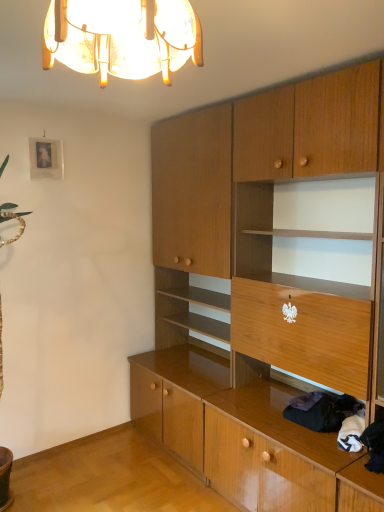
What do you see at coordinates (321, 410) in the screenshot?
I see `dark woolen sweater at lower right` at bounding box center [321, 410].

What do you see at coordinates (46, 158) in the screenshot? I see `matte silver picture frame at upper left` at bounding box center [46, 158].

Locate an element on the screen. Image resolution: width=384 pixels, height=512 pixels. dark woolen sweater at lower right is located at coordinates (321, 410).

Between translucent glass chandelier at upper center and wooden cabinet at center, which one has larger width?

Wider between the two is wooden cabinet at center.

Considering the sizes of translucent glass chandelier at upper center and wooden cabinet at center in the image, is translucent glass chandelier at upper center taller or shorter than wooden cabinet at center?

Clearly, translucent glass chandelier at upper center is shorter compared to wooden cabinet at center.

Can we say translucent glass chandelier at upper center lies outside wooden cabinet at center?

translucent glass chandelier at upper center lies outside wooden cabinet at center's area.

Considering the sizes of matte silver picture frame at upper left and wooden cabinet at center in the image, is matte silver picture frame at upper left bigger or smaller than wooden cabinet at center?

matte silver picture frame at upper left is smaller than wooden cabinet at center.

Is matte silver picture frame at upper left oriented towards wooden cabinet at center?

No.

Which is in front, point (41, 150) or point (330, 298)?

The point (330, 298) is in front.

In terms of width, does matte silver picture frame at upper left look wider or thinner when compared to wooden cabinet at center?

Considering their sizes, matte silver picture frame at upper left looks slimmer than wooden cabinet at center.

Is matte silver picture frame at upper left bigger than translucent glass chandelier at upper center?

No, matte silver picture frame at upper left is not bigger than translucent glass chandelier at upper center.

Can you confirm if matte silver picture frame at upper left is taller than translucent glass chandelier at upper center?

Correct, matte silver picture frame at upper left is much taller as translucent glass chandelier at upper center.

Does matte silver picture frame at upper left lie behind translucent glass chandelier at upper center?

Yes, it is behind translucent glass chandelier at upper center.

Looking at this image, from a real-world perspective, which is physically above, matte silver picture frame at upper left or translucent glass chandelier at upper center?

translucent glass chandelier at upper center is physically above.

Can you confirm if translucent glass chandelier at upper center is shorter than dark woolen sweater at lower right?

Incorrect, the height of translucent glass chandelier at upper center does not fall short of that of dark woolen sweater at lower right.

Is translucent glass chandelier at upper center completely or partially outside of dark woolen sweater at lower right?

Absolutely, translucent glass chandelier at upper center is external to dark woolen sweater at lower right.

In the scene shown: Is translucent glass chandelier at upper center oriented away from dark woolen sweater at lower right?

translucent glass chandelier at upper center does not have its back to dark woolen sweater at lower right.

From the image's perspective, is translucent glass chandelier at upper center above or below dark woolen sweater at lower right?

Based on their image positions, translucent glass chandelier at upper center is located above dark woolen sweater at lower right.

Would you consider wooden cabinet at center to be distant from dark woolen sweater at lower right?

No, wooden cabinet at center is in close proximity to dark woolen sweater at lower right.

From the image's perspective, is wooden cabinet at center above dark woolen sweater at lower right?

Yes, from the image's perspective, wooden cabinet at center is above dark woolen sweater at lower right.

In the scene shown: What's the angular difference between wooden cabinet at center and dark woolen sweater at lower right's facing directions?

They differ by 0.000452 degrees in their facing directions.

From a real-world perspective, is wooden cabinet at center positioned over matte silver picture frame at upper left based on gravity?

No, from a real-world perspective, wooden cabinet at center is not over matte silver picture frame at upper left

Which is more to the right, wooden cabinet at center or matte silver picture frame at upper left?

Positioned to the right is wooden cabinet at center.

Is point (366, 493) closer or farther from the camera than point (56, 148)?

Point (366, 493) appears to be closer to the viewer than point (56, 148).

Between wooden cabinet at center and matte silver picture frame at upper left, which one is positioned behind?

matte silver picture frame at upper left is more distant.

From the image's perspective, which object appears higher, matte silver picture frame at upper left or dark woolen sweater at lower right?

matte silver picture frame at upper left.

Between matte silver picture frame at upper left and dark woolen sweater at lower right, which one is positioned behind?

Positioned behind is matte silver picture frame at upper left.

Considering the points (41, 154) and (313, 400), which point is in front, point (41, 154) or point (313, 400)?

The point (313, 400) is in front.

Does matte silver picture frame at upper left have a greater height compared to dark woolen sweater at lower right?

Indeed, matte silver picture frame at upper left has a greater height compared to dark woolen sweater at lower right.

You are a GUI agent. You are given a task and a screenshot of the screen. Output one action in this format:
    pyautogui.click(x=<x>, y=<y>)
    Task: Click on the cabinetry below the translucent glass chandelier at upper center (from the image's perspective)
    
    Given the screenshot: What is the action you would take?
    pyautogui.click(x=263, y=291)

You are a GUI agent. You are given a task and a screenshot of the screen. Output one action in this format:
    pyautogui.click(x=<x>, y=<y>)
    Task: Click on the picture frame above the wooden cabinet at center (from a real-world perspective)
    This screenshot has width=384, height=512.
    Given the screenshot: What is the action you would take?
    pyautogui.click(x=46, y=158)

Based on their spatial positions, is translucent glass chandelier at upper center or dark woolen sweater at lower right further from wooden cabinet at center?

translucent glass chandelier at upper center is positioned further to the anchor wooden cabinet at center.

Which object lies further to the anchor point wooden cabinet at center, matte silver picture frame at upper left or translucent glass chandelier at upper center?

The object further to wooden cabinet at center is translucent glass chandelier at upper center.

Considering their positions, is translucent glass chandelier at upper center positioned further to dark woolen sweater at lower right than matte silver picture frame at upper left?

matte silver picture frame at upper left lies further to dark woolen sweater at lower right than the other object.

In the scene shown: Based on their spatial positions, is dark woolen sweater at lower right or matte silver picture frame at upper left closer to translucent glass chandelier at upper center?

The object closer to translucent glass chandelier at upper center is dark woolen sweater at lower right.

From the image, which object appears to be farther from matte silver picture frame at upper left, wooden cabinet at center or dark woolen sweater at lower right?

dark woolen sweater at lower right is further to matte silver picture frame at upper left.

From the image, which object appears to be farther from wooden cabinet at center, dark woolen sweater at lower right or translucent glass chandelier at upper center?

translucent glass chandelier at upper center lies further to wooden cabinet at center than the other object.

Which object lies further to the anchor point matte silver picture frame at upper left, wooden cabinet at center or translucent glass chandelier at upper center?

translucent glass chandelier at upper center is further to matte silver picture frame at upper left.

Looking at the image, which one is located further to matte silver picture frame at upper left, translucent glass chandelier at upper center or dark woolen sweater at lower right?

dark woolen sweater at lower right lies further to matte silver picture frame at upper left than the other object.

Locate an element on the screen. The image size is (384, 512). cabinetry located between matte silver picture frame at upper left and dark woolen sweater at lower right in the left-right direction is located at coordinates (263, 291).

Identify the location of clothing between translucent glass chandelier at upper center and matte silver picture frame at upper left in the front-back direction. The width and height of the screenshot is (384, 512). (321, 410).

Where is `cabinetry located between translucent glass chandelier at upper center and matte silver picture frame at upper left in the depth direction`? The image size is (384, 512). cabinetry located between translucent glass chandelier at upper center and matte silver picture frame at upper left in the depth direction is located at coordinates (263, 291).

Find the location of a particular element. This screenshot has width=384, height=512. cabinetry between translucent glass chandelier at upper center and dark woolen sweater at lower right along the z-axis is located at coordinates (263, 291).